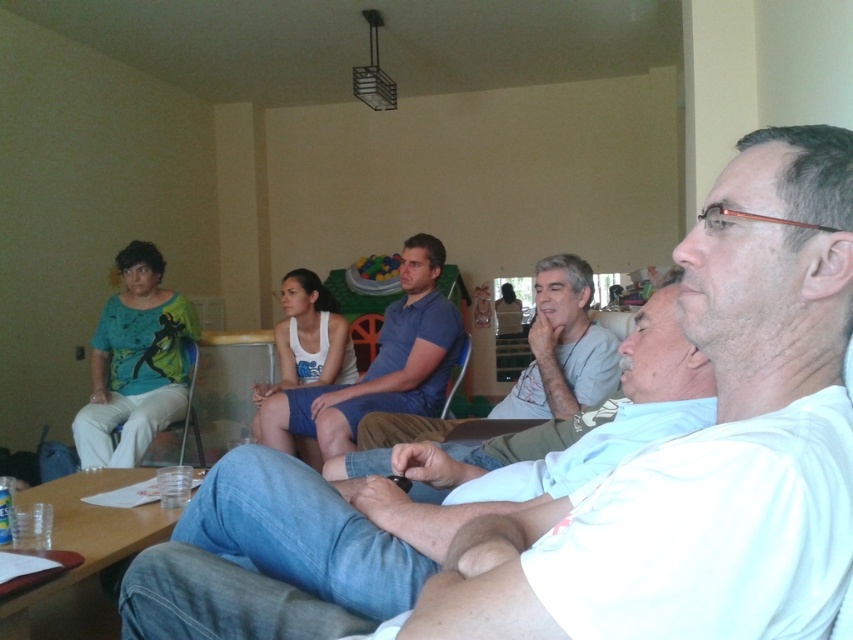
You are organizing a clothing donation drive and need to categorize items by size. You have a blue cotton shorts at center and a gray cotton shirt at center. Which item has a smaller width?

The blue cotton shorts at center has a smaller width than the gray cotton shirt at center according to the description.

You are observing a group of people in a meeting. There is a white cotton shirt at center and a gray cotton shirt at center. Which shirt is closer to you?

The white cotton shirt at center is closer to you because it is positioned under the gray cotton shirt at center, indicating it is in front.

From the picture: You are observing a group of people in a casual meeting. You notice two items of clothing at the center of the image. Which item is shorter in height between the white cotton shirt at center and the blue cotton shorts at center?

The white cotton shirt at center is shorter in height compared to the blue cotton shorts at center.